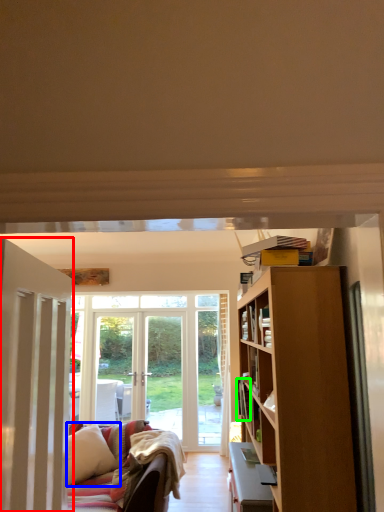
Question: Estimate the real-world distances between objects in this image. Which object is farther from door (highlighted by a red box), pillow (highlighted by a blue box) or book (highlighted by a green box)?

Choices:
 (A) pillow
 (B) book

Answer: (A)